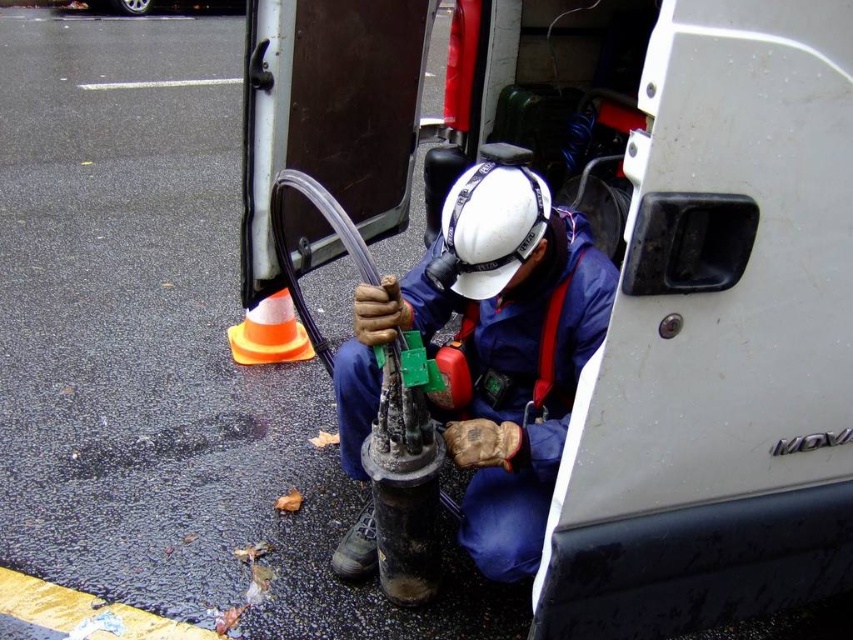
You are a safety inspector evaluating the scene. The blue fabric construction worker at center is standing near the orange reflective plastic traffic cone at lower center. Based on their sizes, which object would you estimate is more likely to be stable in windy conditions?

The blue fabric construction worker at center is larger in width than the orange reflective plastic traffic cone at lower center, so the blue fabric construction worker at center is more stable in windy conditions due to its wider base.

You are a safety inspector standing at the camera position. You need to check the distance between the blue fabric construction worker at center and the nearest fire extinguisher. Can you reach the worker within 4 feet without moving the fire extinguisher?

The blue fabric construction worker at center is 3.54 feet from camera. Since the distance is less than 4 feet, you can reach the worker within the required distance.

You are a pedestrian walking on the sidewalk and see the blue fabric construction worker at center and the orange reflective plastic traffic cone at lower center. Which object is closer to the ground?

The blue fabric construction worker at center is located below orange reflective plastic traffic cone at lower center, so the blue fabric construction worker at center is closer to the ground.